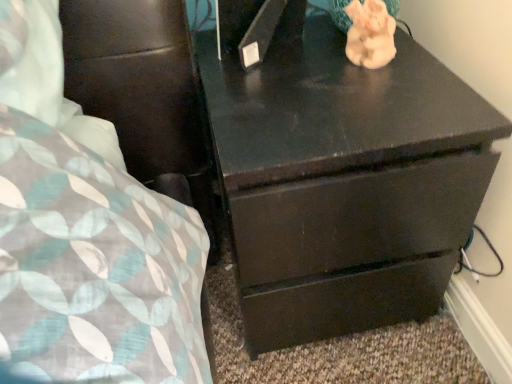
This screenshot has width=512, height=384. Identify the location of free point to the right of porcelain pink elephant at upper right. click(x=421, y=74).